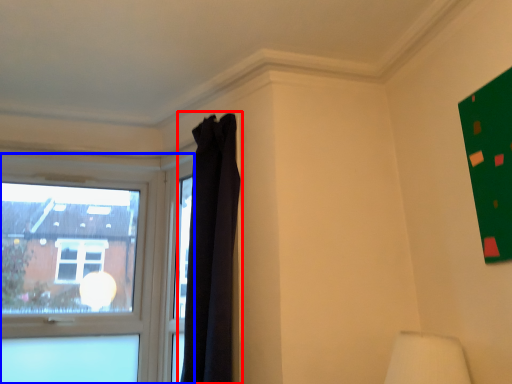
Question: Among these objects, which one is nearest to the camera, curtain (highlighted by a red box) or window (highlighted by a blue box)?

Choices:
 (A) curtain
 (B) window

Answer: (A)